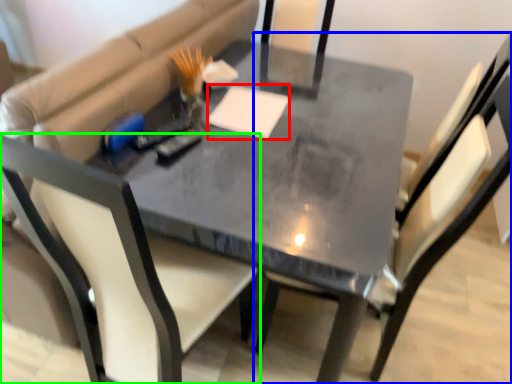
Question: Based on their relative distances, which object is nearer to notepad (highlighted by a red box)? Choose from chair (highlighted by a blue box) and chair (highlighted by a green box).

Choices:
 (A) chair
 (B) chair

Answer: (A)